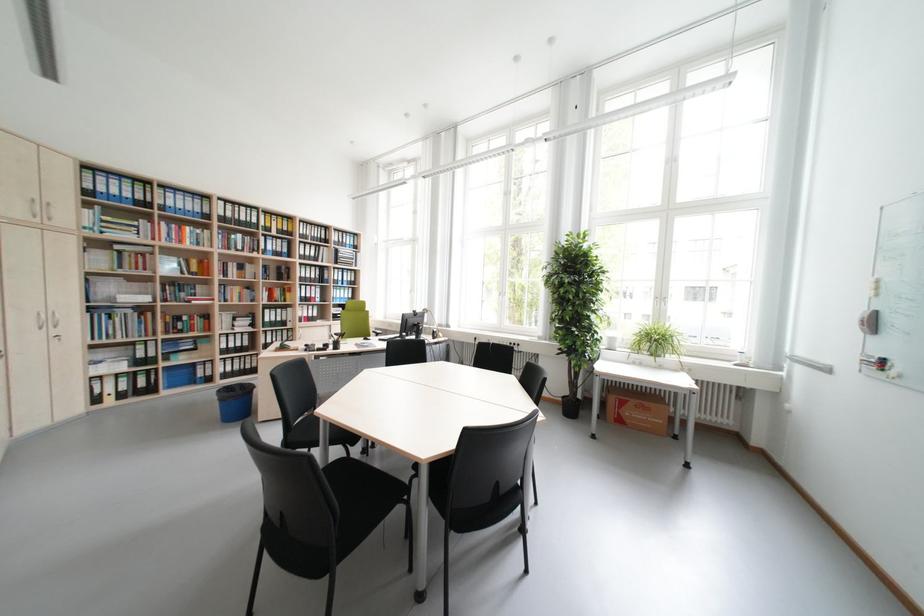
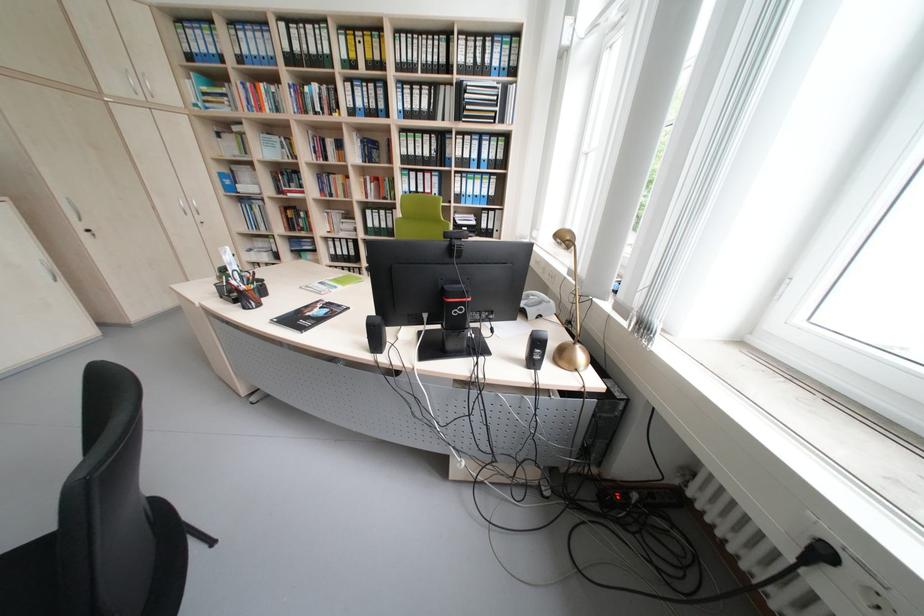
Locate, in the second image, the point that corresponds to (188,320) in the first image.

(309, 217)